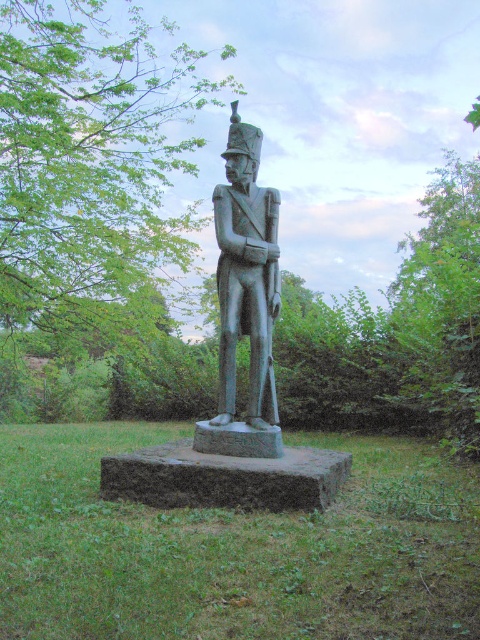
You are a visitor at the park and want to take a photo of the bronze statue at center. However, there is a green leafy tree at upper center blocking the view. Can you move to the left or right to avoid the tree?

The green leafy tree at upper center is located above the bronze statue at center, so moving to the left or right would not help. You need to move forward or backward to adjust your position so the tree is no longer blocking the statue.

You are a park visitor who wants to take a photo of the bronze statue at center. You want to make sure the green leafy tree at upper center doesn

The green leafy tree at upper center is bigger than the bronze statue at center, so it might block the view of the statue if positioned directly in front of it. To ensure the statue is fully visible, position yourself so the tree is not directly between you and the statue, or move closer to reduce the tree